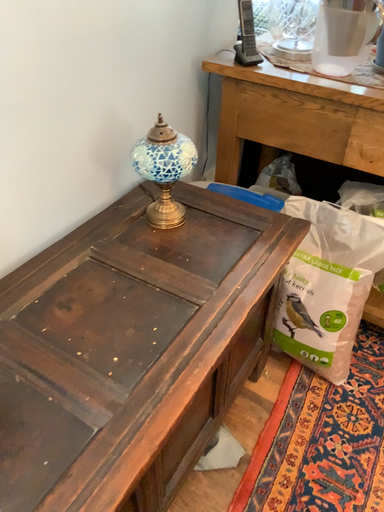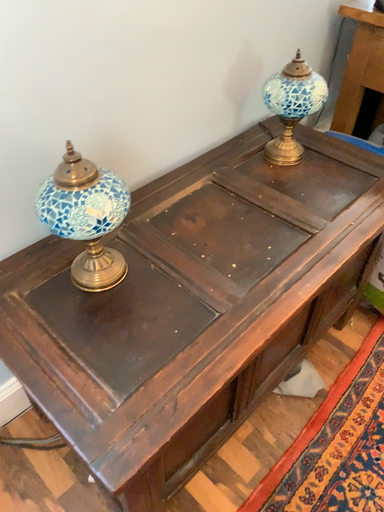
Question: How did the camera likely rotate when shooting the video?

Choices:
 (A) rotated left
 (B) rotated right

Answer: (A)